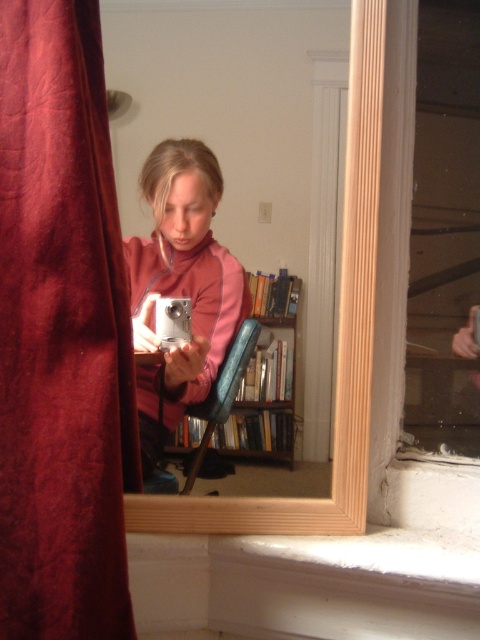
Question: Where is velvet red curtain at left located in relation to woodenmaterial/texturebookshelf at center in the image?

Choices:
 (A) left
 (B) right

Answer: (A)

Question: Among these points, which one is farthest from the camera?

Choices:
 (A) (120, 342)
 (B) (149, 392)
 (C) (273, 404)

Answer: (B)

Question: Which of the following is the closest to the observer?

Choices:
 (A) (283, 324)
 (B) (113, 188)

Answer: (B)

Question: Can you confirm if matte pink sweater at center is positioned below woodenmaterial/texturebookshelf at center?

Choices:
 (A) yes
 (B) no

Answer: (B)

Question: Does matte pink sweater at center lie in front of woodenmaterial/texturebookshelf at center?

Choices:
 (A) yes
 (B) no

Answer: (A)

Question: Which object is the farthest from the woodenmaterial/texturebookshelf at center?

Choices:
 (A) matte pink sweater at center
 (B) velvet red curtain at left

Answer: (B)